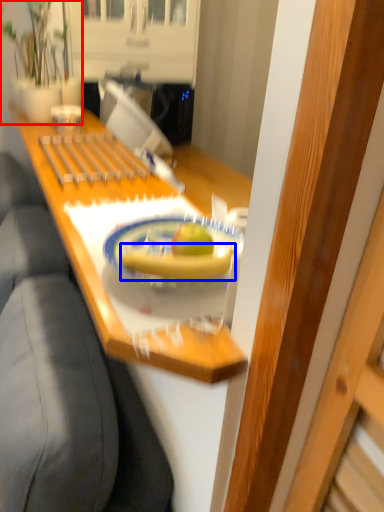
Question: Which object is closer to the camera taking this photo, houseplant (highlighted by a red box) or banana (highlighted by a blue box)?

Choices:
 (A) houseplant
 (B) banana

Answer: (B)